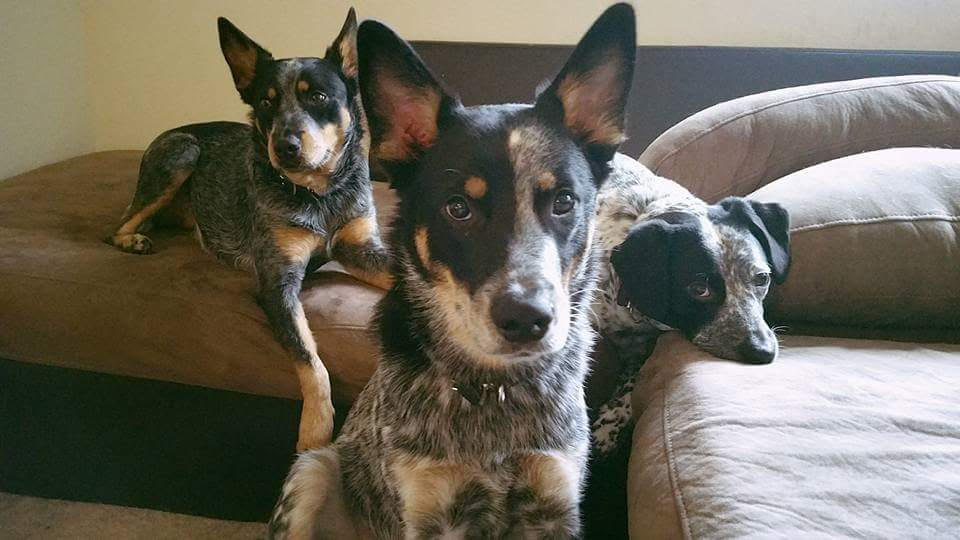
Identify the location of dog's right paw hanging off of couch. (314, 421).